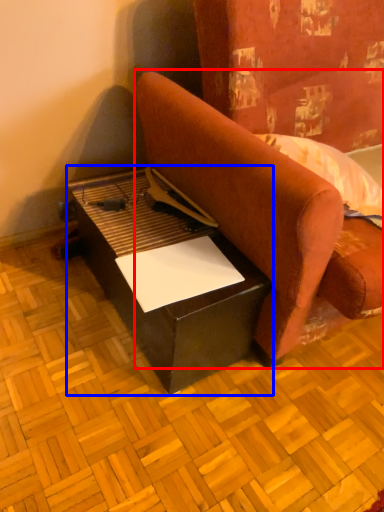
Question: Which point is further to the camera, studio couch (highlighted by a red box) or table (highlighted by a blue box)?

Choices:
 (A) studio couch
 (B) table

Answer: (B)